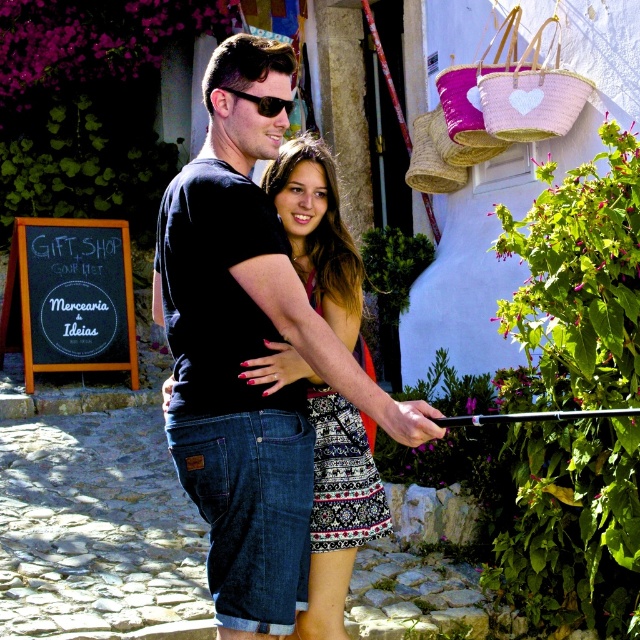
Question: Is the position of black printed fabric dress at center less distant than that of black plastic sunglasses at upper center?

Choices:
 (A) no
 (B) yes

Answer: (A)

Question: Based on their relative distances, which object is farther from the patterned fabric skirt at center?

Choices:
 (A) black chalkboard at left
 (B) black denim shorts at center
 (C) black printed fabric dress at center
 (D) black plastic sunglasses at upper center

Answer: (A)

Question: Is black denim shorts at center positioned in front of patterned fabric skirt at center?

Choices:
 (A) yes
 (B) no

Answer: (A)

Question: Which point is closer to the camera?

Choices:
 (A) (266, 115)
 (B) (314, 236)
 (C) (317, 435)
 (D) (76, 323)

Answer: (A)

Question: Is black denim shorts at center bigger than black printed fabric dress at center?

Choices:
 (A) no
 (B) yes

Answer: (B)

Question: Based on their relative distances, which object is farther from the black denim shorts at center?

Choices:
 (A) black chalkboard at left
 (B) black plastic sunglasses at upper center
 (C) patterned fabric skirt at center

Answer: (A)